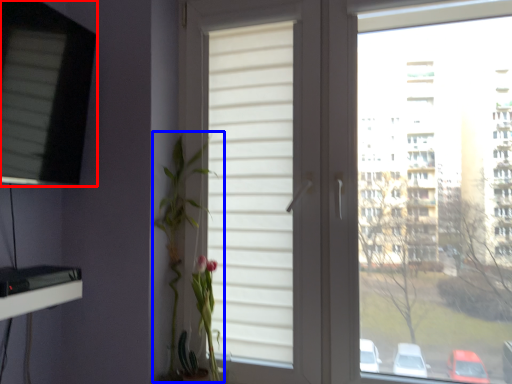
Question: Which object appears farthest to the camera in this image, window (highlighted by a red box) or floral arrangement (highlighted by a blue box)?

Choices:
 (A) window
 (B) floral arrangement

Answer: (B)